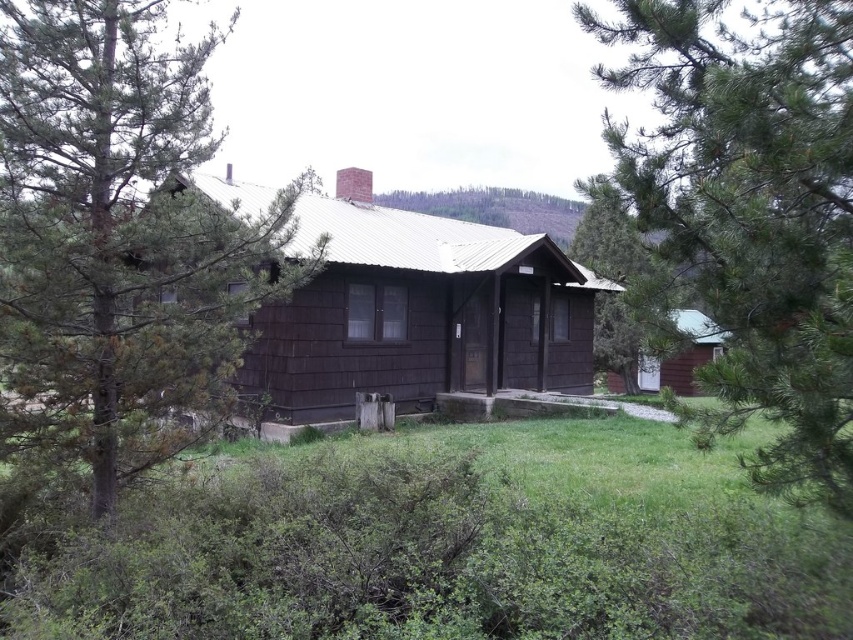
Question: Can you confirm if green pine tree at left is positioned to the left of green pine tree at upper left?

Choices:
 (A) yes
 (B) no

Answer: (A)

Question: Which object is farther from the camera taking this photo?

Choices:
 (A) dark wood cabin at center
 (B) green pine tree at left

Answer: (A)

Question: Is green pine tree at left positioned in front of dark wood cabin at center?

Choices:
 (A) yes
 (B) no

Answer: (A)

Question: Which point is closer to the camera?

Choices:
 (A) green pine tree at left
 (B) green textured tree at center
 (C) dark wood cabin at center
 (D) green pine tree at upper left

Answer: (D)

Question: Can you confirm if green pine tree at upper left is smaller than dark wood cabin at center?

Choices:
 (A) yes
 (B) no

Answer: (A)

Question: Which of the following is the closest to the observer?

Choices:
 (A) (216, 35)
 (B) (466, 262)

Answer: (A)